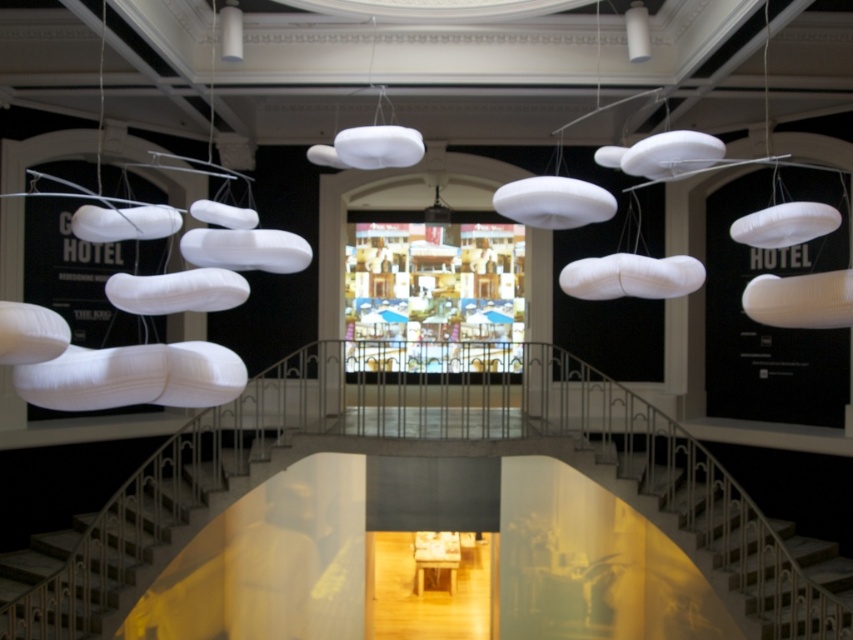
Question: Can you confirm if metallic silver stairs at lower center is positioned above metallic silver stairs at center?

Choices:
 (A) yes
 (B) no

Answer: (A)

Question: Which of the following is the farthest from the observer?

Choices:
 (A) (148, 541)
 (B) (746, 566)
 (C) (223, 8)

Answer: (A)

Question: Estimate the real-world distances between objects in this image. Which object is closer to the white fabric cloud at center?

Choices:
 (A) metallic silver stairs at lower center
 (B) white fabric cloud at upper center
 (C) metallic silver stairs at center

Answer: (B)

Question: Can you confirm if metallic silver stairs at lower center is wider than white fabric cloud at upper center?

Choices:
 (A) yes
 (B) no

Answer: (A)

Question: Can you confirm if metallic silver stairs at center is bigger than white fabric cloud at center?

Choices:
 (A) no
 (B) yes

Answer: (B)

Question: Which point is closer to the camera?

Choices:
 (A) (236, 52)
 (B) (83, 547)
 (C) (403, 138)
 (D) (743, 554)

Answer: (C)